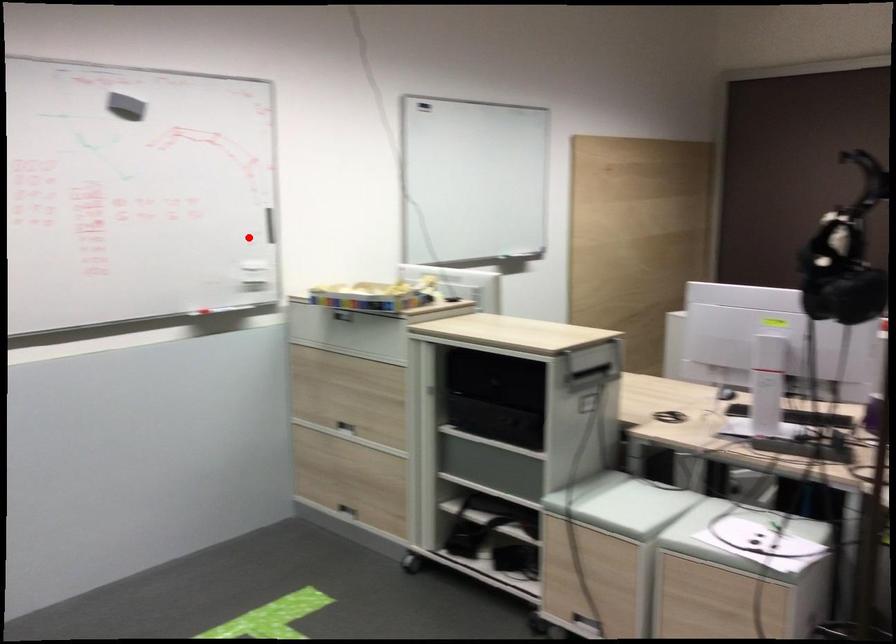
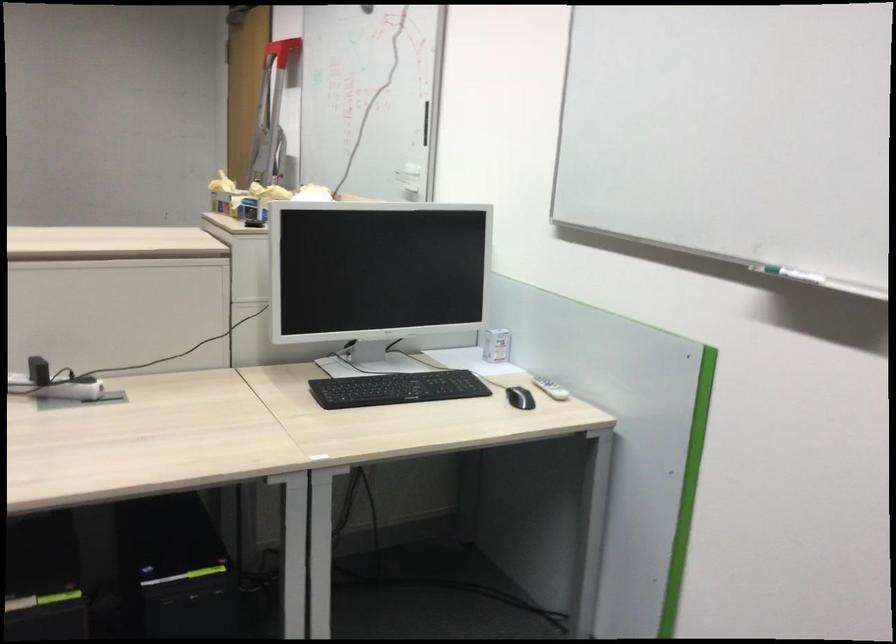
Question: A red point is marked in image1. In image2, is the corresponding 3D point closer to the camera or farther? Reply with the corresponding letter.

Choices:
 (A) The corresponding 3D point is closer.
 (B) The corresponding 3D point is farther.

Answer: (A)